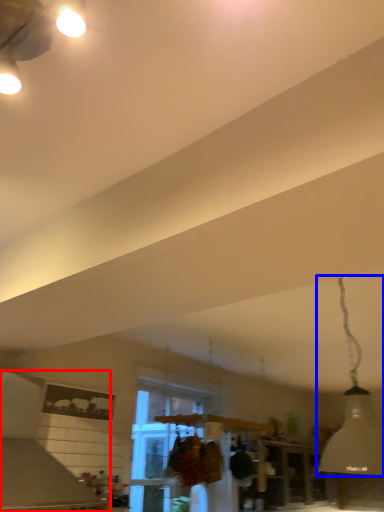
Question: Which point is closer to the camera, vent (highlighted by a red box) or lamp (highlighted by a blue box)?

Choices:
 (A) vent
 (B) lamp

Answer: (B)